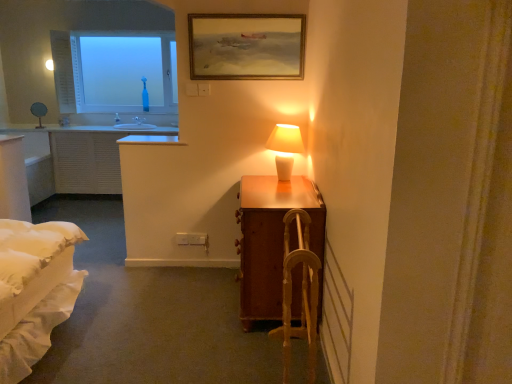
Question: Is the depth of wooden armchair at center less than that of wooden suitcase at right?

Choices:
 (A) yes
 (B) no

Answer: (A)

Question: Is wooden armchair at center touching wooden suitcase at right?

Choices:
 (A) no
 (B) yes

Answer: (A)

Question: Are wooden armchair at center and wooden suitcase at right located far from each other?

Choices:
 (A) yes
 (B) no

Answer: (B)

Question: Can we say wooden armchair at center lies outside wooden suitcase at right?

Choices:
 (A) yes
 (B) no

Answer: (A)

Question: From the image's perspective, is wooden armchair at center over wooden suitcase at right?

Choices:
 (A) no
 (B) yes

Answer: (A)

Question: Would you say transparent glass bottle at upper left is inside or outside white ceramic lamp at upper right?

Choices:
 (A) outside
 (B) inside

Answer: (A)

Question: Is transparent glass bottle at upper left in front of or behind white ceramic lamp at upper right in the image?

Choices:
 (A) behind
 (B) front

Answer: (A)

Question: From their relative heights in the image, would you say transparent glass bottle at upper left is taller or shorter than white ceramic lamp at upper right?

Choices:
 (A) short
 (B) tall

Answer: (B)

Question: Would you say transparent glass bottle at upper left is to the left or to the right of white ceramic lamp at upper right in the picture?

Choices:
 (A) right
 (B) left

Answer: (B)

Question: From a real-world perspective, relative to transparent glass bottle at upper left, is wooden framed painting at upper center vertically above or below?

Choices:
 (A) below
 (B) above

Answer: (B)

Question: Is wooden framed painting at upper center taller or shorter than transparent glass bottle at upper left?

Choices:
 (A) tall
 (B) short

Answer: (B)

Question: In the image, is wooden framed painting at upper center on the left side or the right side of transparent glass bottle at upper left?

Choices:
 (A) right
 (B) left

Answer: (A)

Question: Is point (237, 44) positioned closer to the camera than point (64, 102)?

Choices:
 (A) closer
 (B) farther

Answer: (A)

Question: In terms of size, does wooden suitcase at right appear bigger or smaller than wooden framed painting at upper center?

Choices:
 (A) big
 (B) small

Answer: (A)

Question: Is wooden suitcase at right taller or shorter than wooden framed painting at upper center?

Choices:
 (A) tall
 (B) short

Answer: (A)